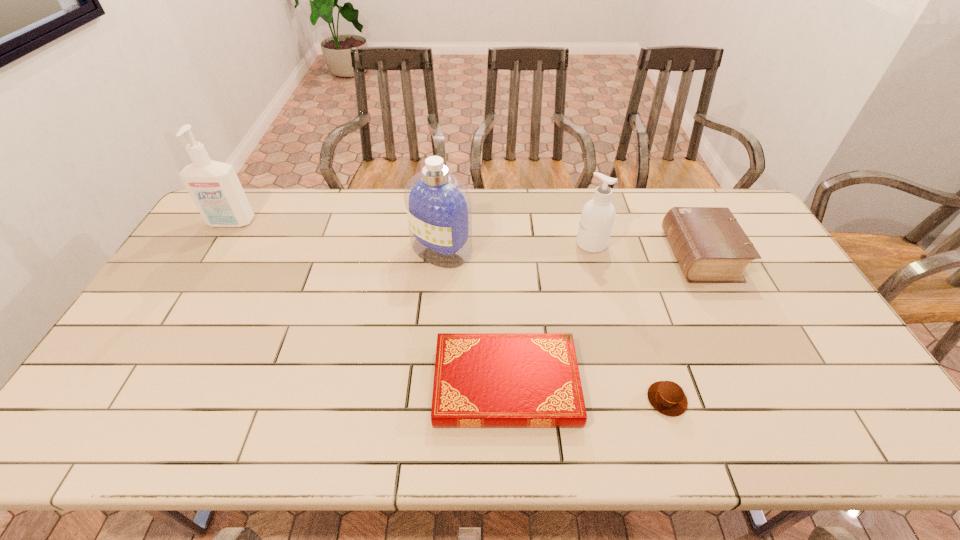
I want to click on the leftmost cleansing agent, so pyautogui.click(x=214, y=186).

The image size is (960, 540). I want to click on the second cleansing agent from left to right, so click(438, 204).

Where is `the rightmost cleansing agent`? The height and width of the screenshot is (540, 960). the rightmost cleansing agent is located at coordinates (597, 218).

Find the location of `the shortest cleansing agent`. the shortest cleansing agent is located at coordinates (597, 218).

The height and width of the screenshot is (540, 960). Find the location of `Bible`. Bible is located at coordinates (710, 246).

You are a GUI agent. You are given a task and a screenshot of the screen. Output one action in this format:
    pyautogui.click(x=<x>, y=<y>)
    Task: Click on the third shortest object
    
    Given the screenshot: What is the action you would take?
    pyautogui.click(x=710, y=246)

The image size is (960, 540). I want to click on muffin, so click(x=667, y=397).

The width and height of the screenshot is (960, 540). In order to click on hardback book in this screenshot , I will do `click(481, 380)`.

Find the location of `vacant space located 0.320m on the front label of the leftmost cleansing agent`. vacant space located 0.320m on the front label of the leftmost cleansing agent is located at coordinates (182, 303).

Image resolution: width=960 pixels, height=540 pixels. In order to click on vacant region located 0.230m on the back of the second cleansing agent from left to right in this screenshot , I will do coord(446,191).